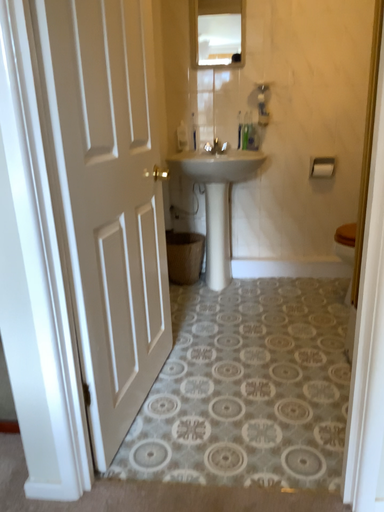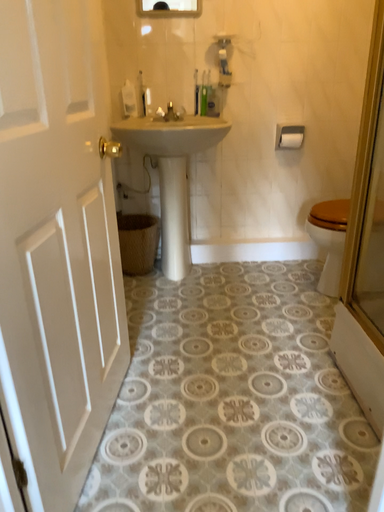
Question: How did the camera likely rotate when shooting the video?

Choices:
 (A) rotated left
 (B) rotated right

Answer: (B)